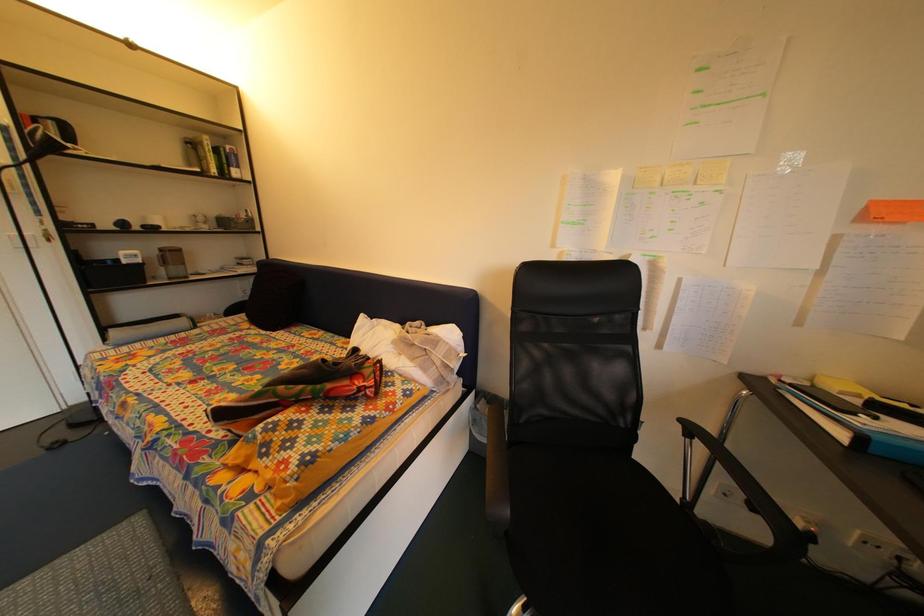
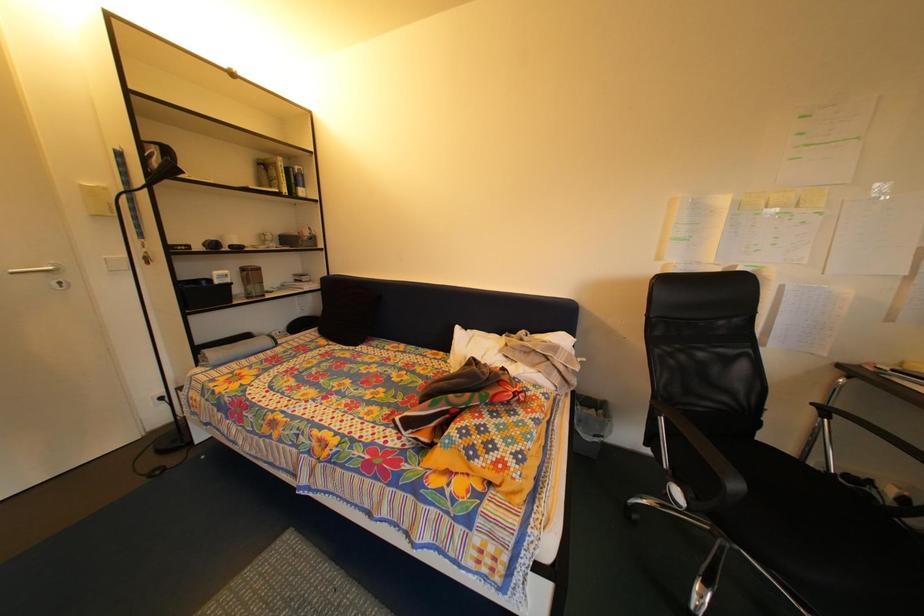
Question: The first image is from the beginning of the video and the second image is from the end. How did the camera likely rotate when shooting the video?

Choices:
 (A) Left
 (B) Right
 (C) Up
 (D) Down

Answer: (B)